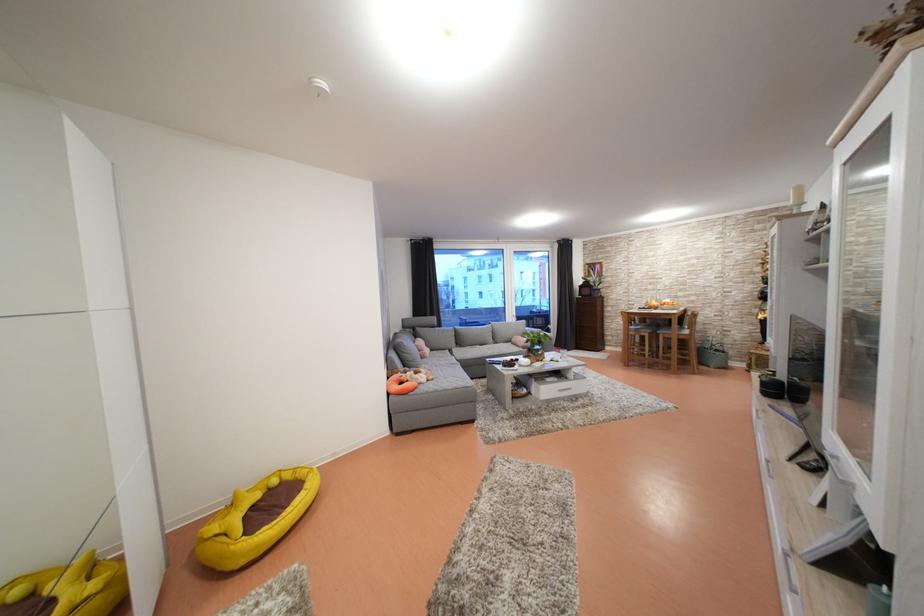
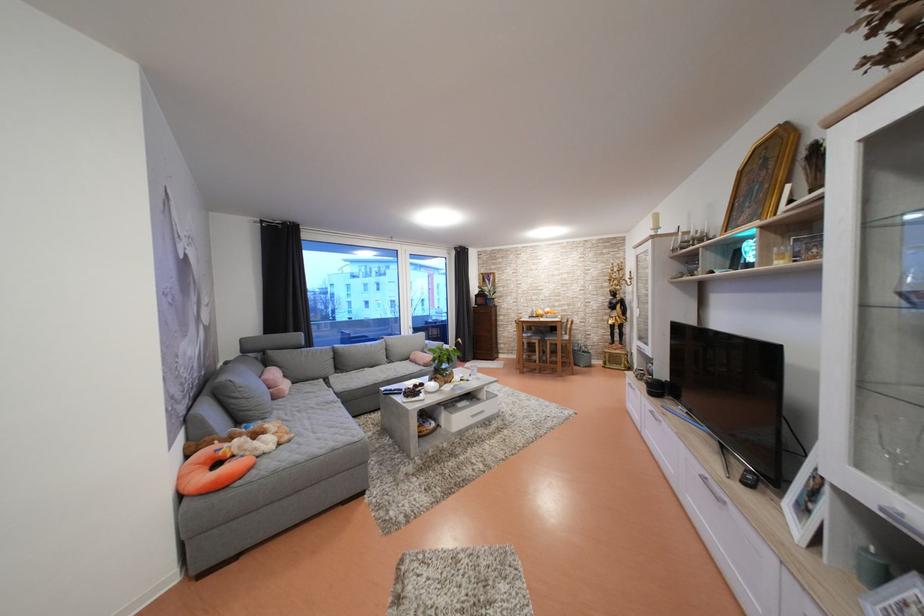
Where in the second image is the point corresponding to point (775, 467) from the first image?

(711, 484)